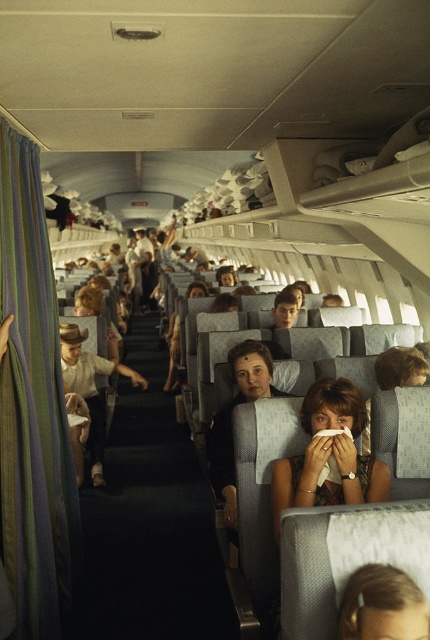
Question: Which point appears farthest from the camera in this image?

Choices:
 (A) (239, 346)
 (B) (316, 458)

Answer: (A)

Question: Among these points, which one is nearest to the camera?

Choices:
 (A) (230, 410)
 (B) (350, 456)
 (C) (162, 483)

Answer: (B)

Question: Considering the relative positions of black fabric at center and matte gray hair at center in the image provided, where is black fabric at center located with respect to matte gray hair at center?

Choices:
 (A) left
 (B) right

Answer: (A)

Question: Does matte gray hair at center appear under matte black hair at center?

Choices:
 (A) no
 (B) yes

Answer: (A)

Question: Which object is farther from the camera taking this photo?

Choices:
 (A) black fabric at center
 (B) matte gray hair at center
 (C) matte black hair at center

Answer: (A)

Question: Does black fabric at center lie in front of matte black hair at center?

Choices:
 (A) yes
 (B) no

Answer: (B)